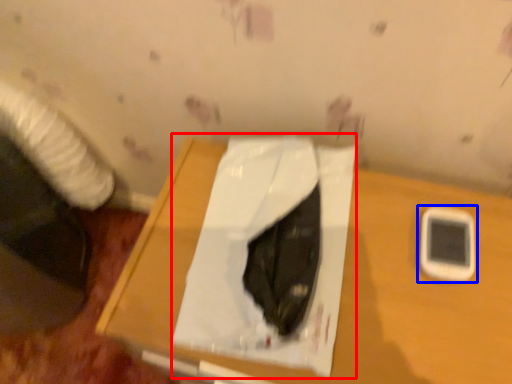
Question: Which object appears farthest to the camera in this image, sheet (highlighted by a red box) or mobile phone (highlighted by a blue box)?

Choices:
 (A) sheet
 (B) mobile phone

Answer: (B)